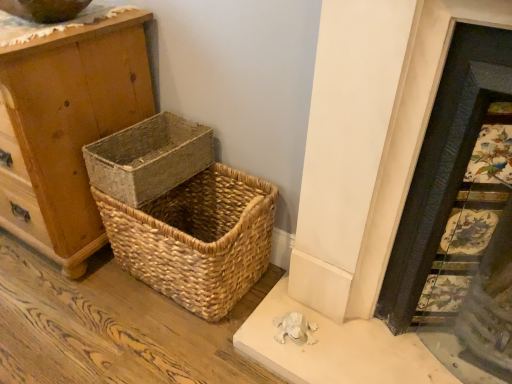
Identify the location of free space in front of natural woven picnic basket at lower left, the 2th picnic basket viewed from the top. This screenshot has height=384, width=512. (151, 342).